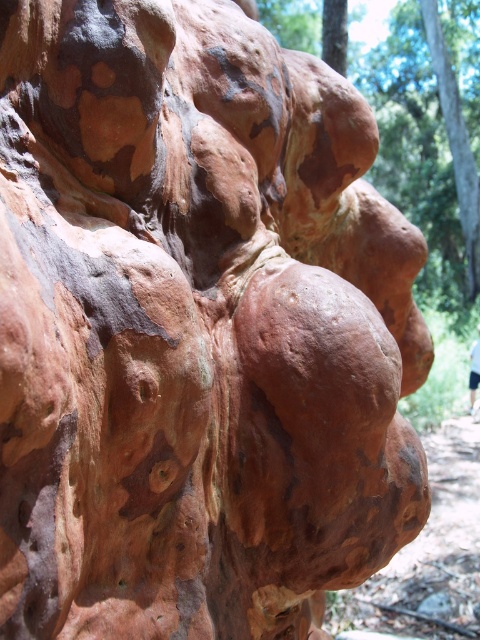
You are an artist setting up an easel to paint the rustic bark tree trunk at center and the light blue fabric at center. Since you want to capture their sizes accurately, which object should you place closer to you on the canvas?

The rustic bark tree trunk at center has a larger size compared to the light blue fabric at center, so you should place the rustic bark tree trunk at center closer to you on the canvas to maintain accurate proportions.

You are standing in a forest and see the rustic bark tree trunk at center and the light blue fabric at center. Which object is closer to you?

The rustic bark tree trunk at center is closer to you because the light blue fabric at center is behind it.

You are a photographer adjusting your camera to focus on two specific points on the rock formation. The points are labeled as point (397,141) and point (474,353). Which point should you focus on first if you want to ensure both points are in sharp focus?

You should focus on point (397,141) first because it is closer to the camera than point (474,353). By focusing on the closer point, the farther point will also be within the depth of field, ensuring both are in focus.